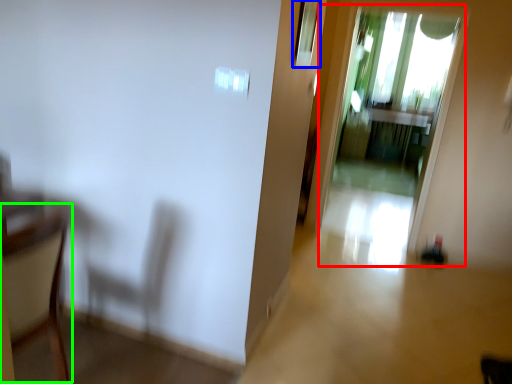
Question: Estimate the real-world distances between objects in this image. Which object is farther from screen door (highlighted by a red box), window (highlighted by a blue box) or armchair (highlighted by a green box)?

Choices:
 (A) window
 (B) armchair

Answer: (B)